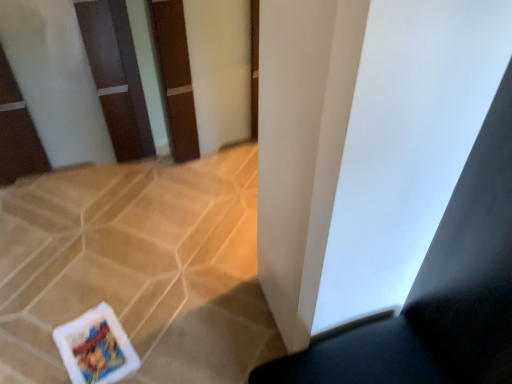
The height and width of the screenshot is (384, 512). Describe the element at coordinates (137, 267) in the screenshot. I see `white tile at lower left` at that location.

Where is `white tile at lower left`? The width and height of the screenshot is (512, 384). white tile at lower left is located at coordinates (137, 267).

The image size is (512, 384). What are the coordinates of `white tile at lower left` in the screenshot? It's located at (137, 267).